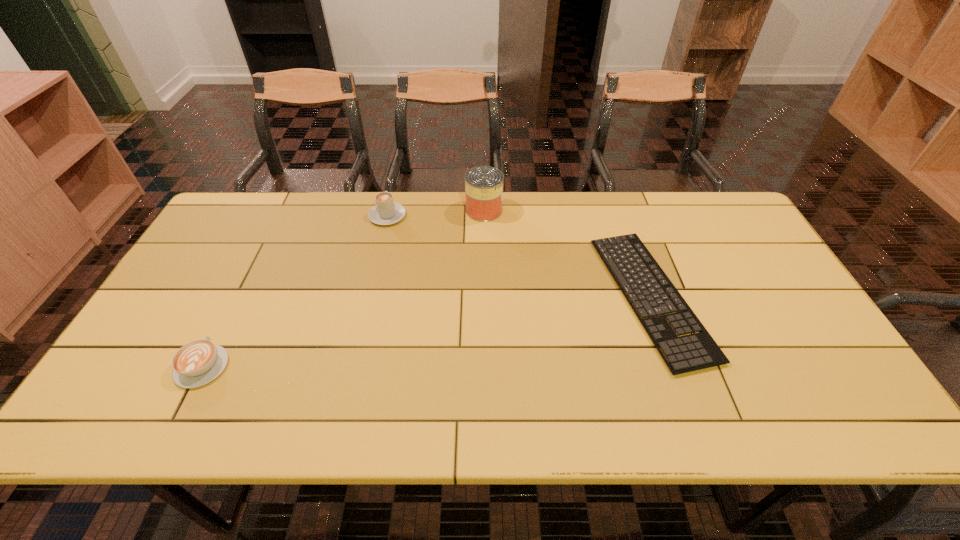
The image size is (960, 540). I want to click on the tallest object, so click(483, 185).

Identify the location of can. (483, 185).

This screenshot has height=540, width=960. Identify the location of the taller cappuccino. (386, 212).

Locate an element on the screen. The height and width of the screenshot is (540, 960). the right cappuccino is located at coordinates (386, 212).

Identify the location of the left cappuccino. (197, 363).

Locate an element on the screen. the shorter cappuccino is located at coordinates (197, 363).

The image size is (960, 540). What are the coordinates of `the shortest object` in the screenshot? It's located at (696, 351).

The width and height of the screenshot is (960, 540). What are the coordinates of `the rightmost object` in the screenshot? It's located at (696, 351).

Identify the location of free region located on the left of the second object from right to left. This screenshot has height=540, width=960. (435, 210).

Find the location of a particular element. blank space located to the right of the taller cappuccino is located at coordinates (393, 192).